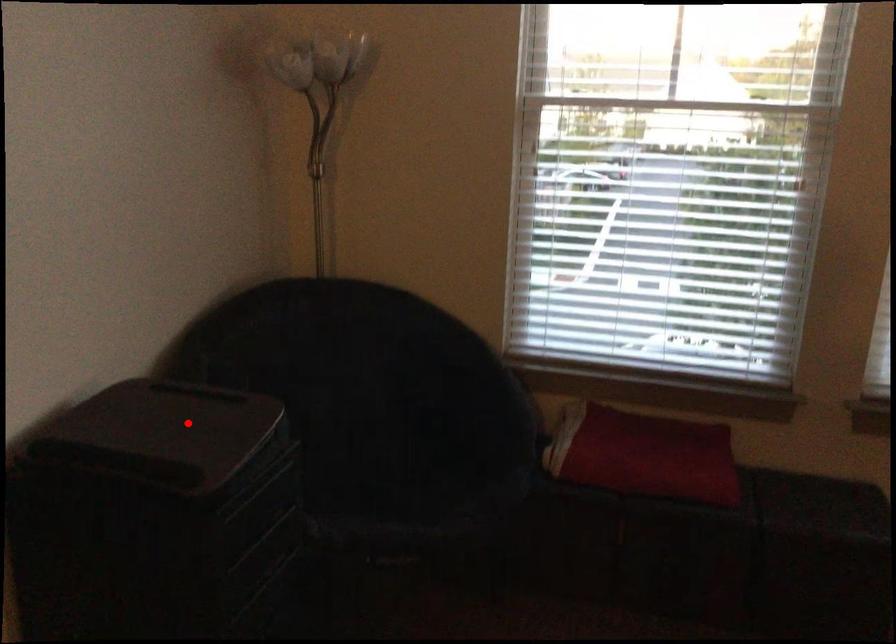
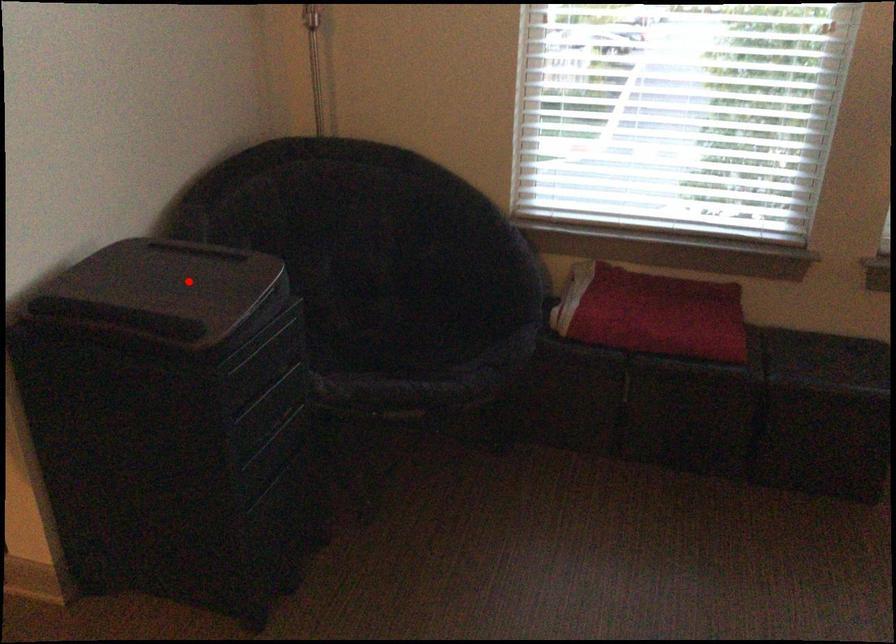
I am providing you with two images of the same scene from different viewpoints. A red point is marked on the first image and another point is marked on the second image. Are the points marked in image1 and image2 representing the same 3D position?

Yes